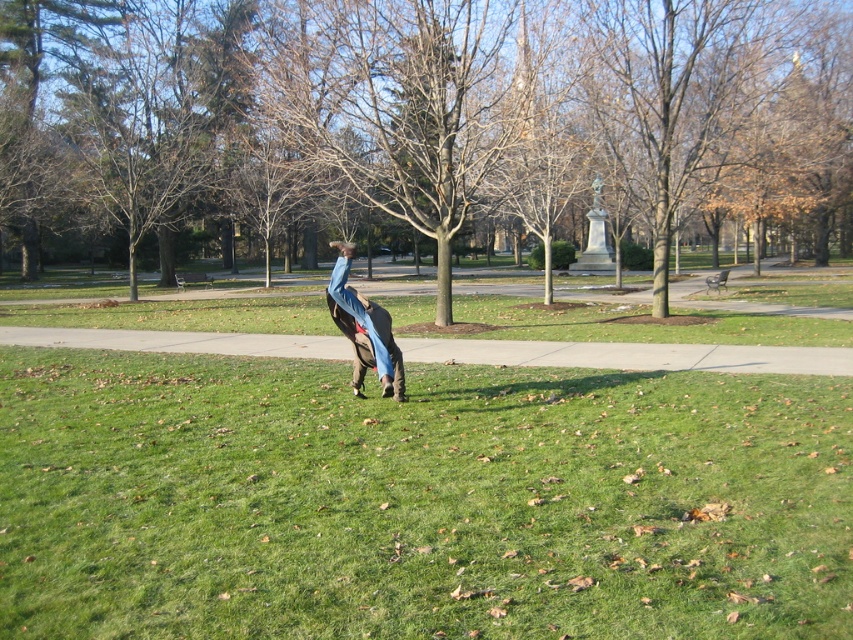
Question: Does brown wood tree at center appear over denim pants at center?

Choices:
 (A) no
 (B) yes

Answer: (B)

Question: Which object is farther from the camera taking this photo?

Choices:
 (A) denim pants at center
 (B) brown wood tree at center
 (C) green grass at center

Answer: (B)

Question: Observing the image, what is the correct spatial positioning of brown wood tree at center in reference to denim pants at center?

Choices:
 (A) above
 (B) below

Answer: (A)

Question: Considering the relative positions of green grass at center and brown wood tree at center in the image provided, where is green grass at center located with respect to brown wood tree at center?

Choices:
 (A) left
 (B) right

Answer: (B)

Question: Estimate the real-world distances between objects in this image. Which object is closer to the green grass at center?

Choices:
 (A) denim pants at center
 (B) brown wood tree at center

Answer: (A)

Question: Which of the following is the farthest from the observer?

Choices:
 (A) (397, 179)
 (B) (363, 298)
 (C) (495, 576)

Answer: (A)